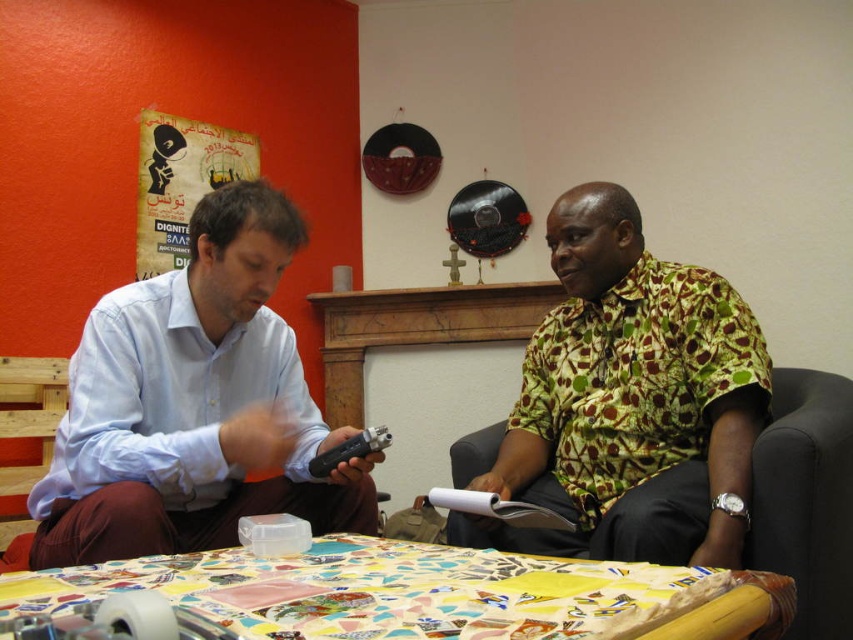
Which is more to the left, light blue shirt at left or dark green fabric armchair at right?

Positioned to the left is light blue shirt at left.

What do you see at coordinates (194, 404) in the screenshot? This screenshot has width=853, height=640. I see `light blue shirt at left` at bounding box center [194, 404].

Where is `light blue shirt at left`? This screenshot has width=853, height=640. light blue shirt at left is located at coordinates (194, 404).

Does green patterned shirt at center have a greater height compared to dark green fabric armchair at right?

Indeed, green patterned shirt at center has a greater height compared to dark green fabric armchair at right.

Looking at this image, which is more to the right, green patterned shirt at center or dark green fabric armchair at right?

dark green fabric armchair at right is more to the right.

Image resolution: width=853 pixels, height=640 pixels. What do you see at coordinates (630, 401) in the screenshot?
I see `green patterned shirt at center` at bounding box center [630, 401].

This screenshot has width=853, height=640. Find the location of `green patterned shirt at center`. green patterned shirt at center is located at coordinates (630, 401).

Is point (419, 620) positioned before point (807, 412)?

That is True.

Can you confirm if multicolored mosaic table at center is positioned to the right of dark green fabric armchair at right?

Incorrect, multicolored mosaic table at center is not on the right side of dark green fabric armchair at right.

The width and height of the screenshot is (853, 640). What do you see at coordinates (426, 593) in the screenshot?
I see `multicolored mosaic table at center` at bounding box center [426, 593].

Image resolution: width=853 pixels, height=640 pixels. Find the location of `multicolored mosaic table at center`. multicolored mosaic table at center is located at coordinates (426, 593).